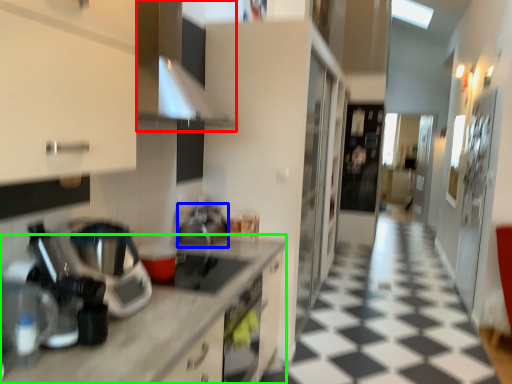
Question: Which is nearer to the exhaust hood (highlighted by a red box)? appliance (highlighted by a blue box) or countertop (highlighted by a green box).

Choices:
 (A) appliance
 (B) countertop

Answer: (B)